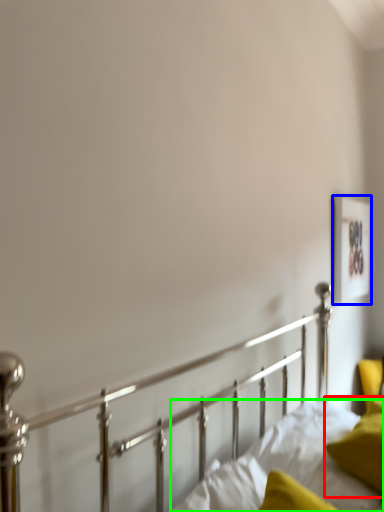
Question: Considering the real-world distances, which object is closest to pillow (highlighted by a red box)? picture frame (highlighted by a blue box) or mattress (highlighted by a green box).

Choices:
 (A) picture frame
 (B) mattress

Answer: (B)